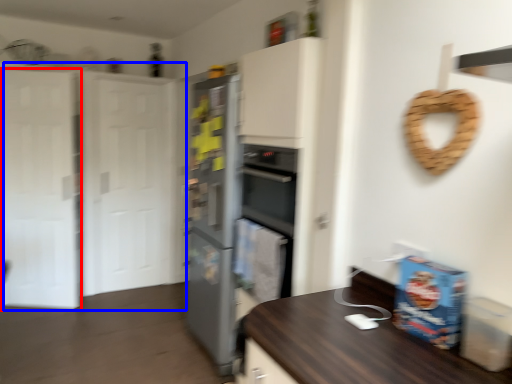
Question: Which object is closer to the camera taking this photo, glass door (highlighted by a red box) or door (highlighted by a blue box)?

Choices:
 (A) glass door
 (B) door

Answer: (B)